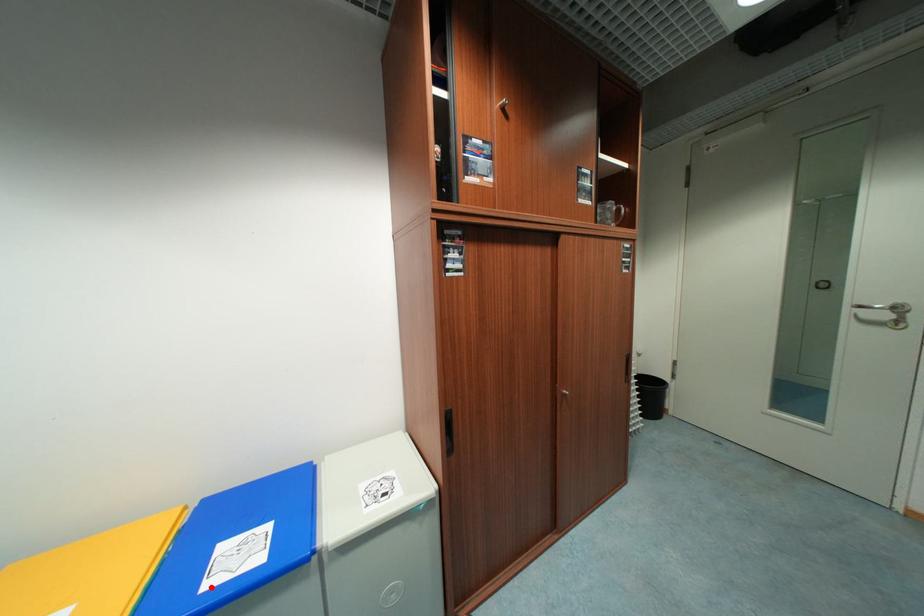
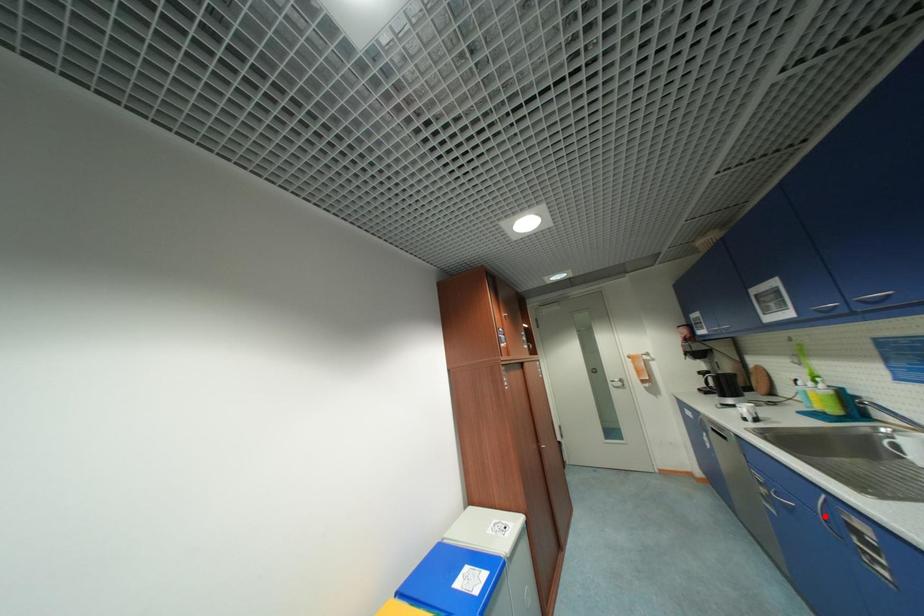
I am providing you with two images of the same scene from different viewpoints. A red point is marked on the first image and another point is marked on the second image. Do the highlighted points in image1 and image2 indicate the same real-world spot?

No